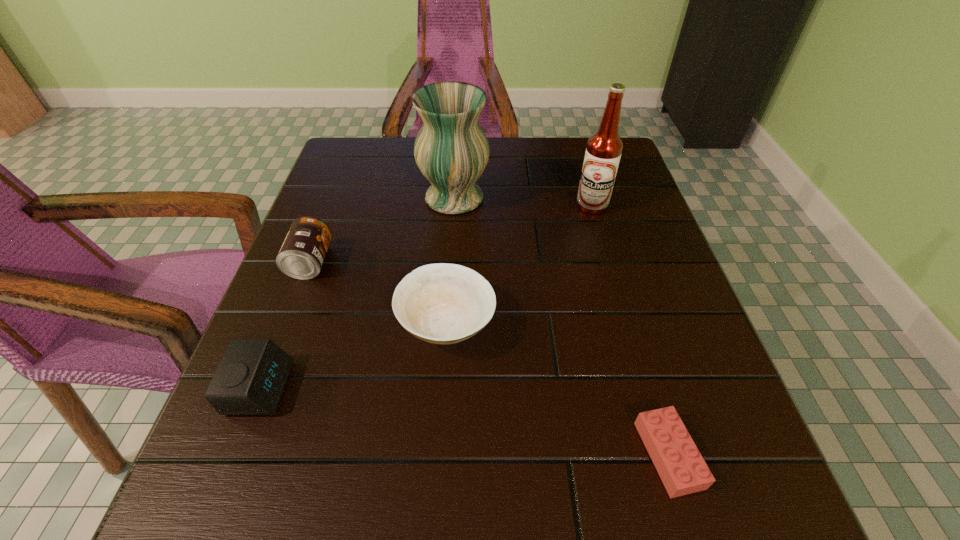
The image size is (960, 540). What are the coordinates of `free point between the bowl and the Lego` in the screenshot? It's located at (558, 389).

Identify the location of vacant point located between the bowl and the alcohol. Image resolution: width=960 pixels, height=540 pixels. (519, 265).

The height and width of the screenshot is (540, 960). I want to click on vacant area that lies between the can and the bowl, so (378, 293).

Image resolution: width=960 pixels, height=540 pixels. Find the location of `free spot between the vase and the third farthest object`. free spot between the vase and the third farthest object is located at coordinates (382, 230).

Point out which object is positioned as the fifth nearest to the alcohol. Please provide its 2D coordinates. Your answer should be formatted as a tuple, i.e. [(x, y)], where the tuple contains the x and y coordinates of a point satisfying the conditions above.

[(250, 380)]

You are a GUI agent. You are given a task and a screenshot of the screen. Output one action in this format:
    pyautogui.click(x=<x>, y=<y>)
    Task: Click on the object that is the third nearest to the alarm clock
    
    Given the screenshot: What is the action you would take?
    pyautogui.click(x=451, y=150)

Locate an element on the screen. The width and height of the screenshot is (960, 540). blank space that satisfies the following two spatial constraints: 1. on the front-facing side of the alarm clock; 2. on the back side of the shortest object is located at coordinates (234, 455).

You are a GUI agent. You are given a task and a screenshot of the screen. Output one action in this format:
    pyautogui.click(x=<x>, y=<y>)
    Task: Click on the free space that satisfies the following two spatial constraints: 1. on the front label of the can; 2. on the right side of the Lego
    This screenshot has width=960, height=540.
    Given the screenshot: What is the action you would take?
    pyautogui.click(x=237, y=455)

At what (x,y) coordinates should I click in order to perform the action: click on vacant area that satisfies the following two spatial constraints: 1. on the back side of the bowl; 2. on the front label of the can. Please return your answer as a coordinate pair (x, y). Looking at the image, I should click on (450, 262).

At what (x,y) coordinates should I click in order to perform the action: click on vacant region that satisfies the following two spatial constraints: 1. on the front label of the third farthest object; 2. on the right side of the bowl. Please return your answer as a coordinate pair (x, y). This screenshot has width=960, height=540. Looking at the image, I should click on (287, 324).